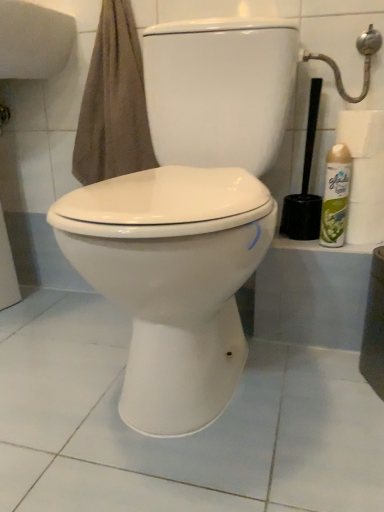
Question: From the image's perspective, is white glossy toilet at center located beneath black plastic toilet brush at right?

Choices:
 (A) no
 (B) yes

Answer: (B)

Question: Does white glossy toilet at center have a greater height compared to black plastic toilet brush at right?

Choices:
 (A) no
 (B) yes

Answer: (B)

Question: Considering the relative positions of white glossy toilet at center and black plastic toilet brush at right in the image provided, is white glossy toilet at center to the left of black plastic toilet brush at right from the viewer's perspective?

Choices:
 (A) yes
 (B) no

Answer: (A)

Question: Is white glossy toilet at center turned away from black plastic toilet brush at right?

Choices:
 (A) no
 (B) yes

Answer: (A)

Question: Considering the relative sizes of white glossy toilet at center and black plastic toilet brush at right in the image provided, is white glossy toilet at center smaller than black plastic toilet brush at right?

Choices:
 (A) no
 (B) yes

Answer: (A)

Question: Could black plastic toilet brush at right be considered to be inside white glossy toilet at center?

Choices:
 (A) yes
 (B) no

Answer: (B)

Question: Is white glossy toilet paper at right, the first toilet paper from the bottom, positioned with its back to green spray can at right?

Choices:
 (A) yes
 (B) no

Answer: (B)

Question: Is white glossy toilet paper at right, arranged as the second toilet paper when viewed from the top, bigger than green spray can at right?

Choices:
 (A) yes
 (B) no

Answer: (A)

Question: Is white glossy toilet paper at right, the first toilet paper from the bottom, smaller than green spray can at right?

Choices:
 (A) yes
 (B) no

Answer: (B)

Question: From a real-world perspective, is white glossy toilet paper at right, arranged as the second toilet paper when viewed from the top, under green spray can at right?

Choices:
 (A) no
 (B) yes

Answer: (B)

Question: Does white glossy toilet paper at right, arranged as the second toilet paper when viewed from the top, turn towards green spray can at right?

Choices:
 (A) no
 (B) yes

Answer: (A)

Question: Is white glossy toilet paper at right, the first toilet paper from the bottom, further to the viewer compared to green spray can at right?

Choices:
 (A) yes
 (B) no

Answer: (A)

Question: Could you tell me if white matte toilet paper at right, which is the first toilet paper from top to bottom, is facing metallic silver showerhead at upper right?

Choices:
 (A) no
 (B) yes

Answer: (A)